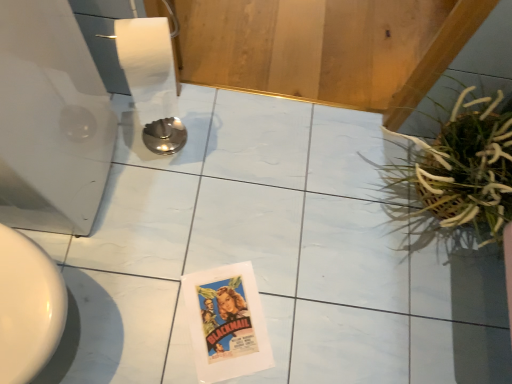
Find the location of a particular element. Image resolution: width=512 pixels, height=384 pixels. white glossy toilet at left is located at coordinates (50, 120).

Describe the element at coordinates (50, 120) in the screenshot. I see `white glossy toilet at left` at that location.

Locate an element on the screen. The height and width of the screenshot is (384, 512). green leafy plant at right is located at coordinates [465, 166].

The image size is (512, 384). Describe the element at coordinates (465, 166) in the screenshot. I see `green leafy plant at right` at that location.

You are a GUI agent. You are given a task and a screenshot of the screen. Output one action in this format:
    pyautogui.click(x=<x>, y=<y>)
    Task: Click on the white glossy toilet at left
    The width and height of the screenshot is (512, 384).
    Given the screenshot: What is the action you would take?
    pyautogui.click(x=50, y=120)

Between white glossy toilet at left and green leafy plant at right, which one appears on the right side from the viewer's perspective?

Positioned to the right is green leafy plant at right.

Is white glossy toilet at left in front of or behind green leafy plant at right in the image?

Visually, white glossy toilet at left is located in front of green leafy plant at right.

Which is in front, point (34, 89) or point (451, 148)?

Point (34, 89)

From the image's perspective, is white glossy toilet at left under green leafy plant at right?

Incorrect, from the image's perspective, white glossy toilet at left is higher than green leafy plant at right.

From a real-world perspective, which object rests below the other?

From a 3D spatial view, green leafy plant at right is below.

Can you confirm if white glossy toilet at left is thinner than green leafy plant at right?

Incorrect, the width of white glossy toilet at left is not less than that of green leafy plant at right.

Can you confirm if white glossy toilet at left is shorter than green leafy plant at right?

No, white glossy toilet at left is not shorter than green leafy plant at right.

Considering the relative sizes of white glossy toilet at left and green leafy plant at right in the image provided, is white glossy toilet at left bigger than green leafy plant at right?

Yes.

Would you say green leafy plant at right is part of white glossy toilet at left's contents?

No, green leafy plant at right is not a part of white glossy toilet at left.

Are white glossy toilet at left and green leafy plant at right located far from each other?

No, white glossy toilet at left is not far from green leafy plant at right.

Could you tell me if white glossy toilet at left is facing green leafy plant at right?

Yes, white glossy toilet at left is oriented towards green leafy plant at right.

How different are the orientations of white glossy toilet at left and green leafy plant at right in degrees?

They differ by 180 degrees in their facing directions.

At what (x,y) coordinates should I click in order to perform the action: click on houseplant behind the white glossy toilet at left. Please return your answer as a coordinate pair (x, y). This screenshot has height=384, width=512. Looking at the image, I should click on (465, 166).

Is green leafy plant at right at the right side of white glossy toilet at left?

Yes.

Considering the relative positions of green leafy plant at right and white glossy toilet at left in the image provided, is green leafy plant at right in front of white glossy toilet at left?

No, green leafy plant at right is behind white glossy toilet at left.

Is point (475, 159) positioned in front of point (106, 137)?

Yes, point (475, 159) is closer to viewer.

From the image's perspective, which object appears higher, green leafy plant at right or white glossy toilet at left?

white glossy toilet at left is shown above in the image.

From a real-world perspective, is green leafy plant at right physically above white glossy toilet at left?

No, from a real-world perspective, green leafy plant at right is not on top of white glossy toilet at left.

Which object is thinner, green leafy plant at right or white glossy toilet at left?

With smaller width is green leafy plant at right.

Can you confirm if green leafy plant at right is shorter than white glossy toilet at left?

Yes.

Between green leafy plant at right and white glossy toilet at left, which one has larger size?

white glossy toilet at left.

Could white glossy toilet at left be considered to be inside green leafy plant at right?

No, white glossy toilet at left is located outside of green leafy plant at right.

Are green leafy plant at right and white glossy toilet at left beside each other?

No, green leafy plant at right is not with white glossy toilet at left.

Is green leafy plant at right positioned with its back to white glossy toilet at left?

That's not correct — green leafy plant at right is not looking away from white glossy toilet at left.

How many degrees apart are the facing directions of green leafy plant at right and white glossy toilet at left?

green leafy plant at right and white glossy toilet at left are facing 180 degrees away from each other.

At what (x,y) coordinates should I click in order to perform the action: click on houseplant located on the right of white glossy toilet at left. Please return your answer as a coordinate pair (x, y). Looking at the image, I should click on (465, 166).

Where is `houseplant below the white glossy toilet at left (from a real-world perspective)`? houseplant below the white glossy toilet at left (from a real-world perspective) is located at coordinates coord(465,166).

Locate an element on the screen. The width and height of the screenshot is (512, 384). appliance located above the green leafy plant at right (from the image's perspective) is located at coordinates (50, 120).